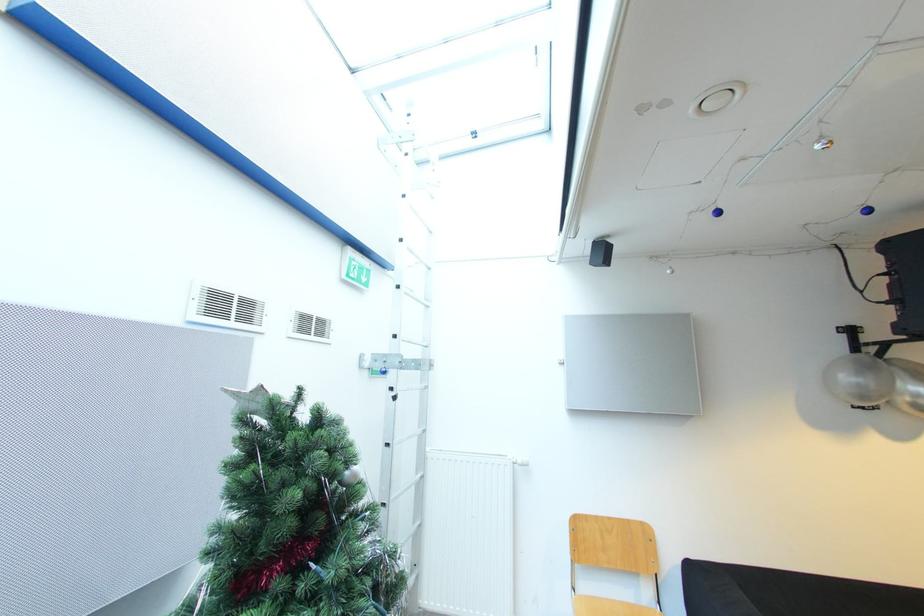
Find where to turn the radiator control valve. Please return your answer as a coordinate pair (x, y).

(521, 463)